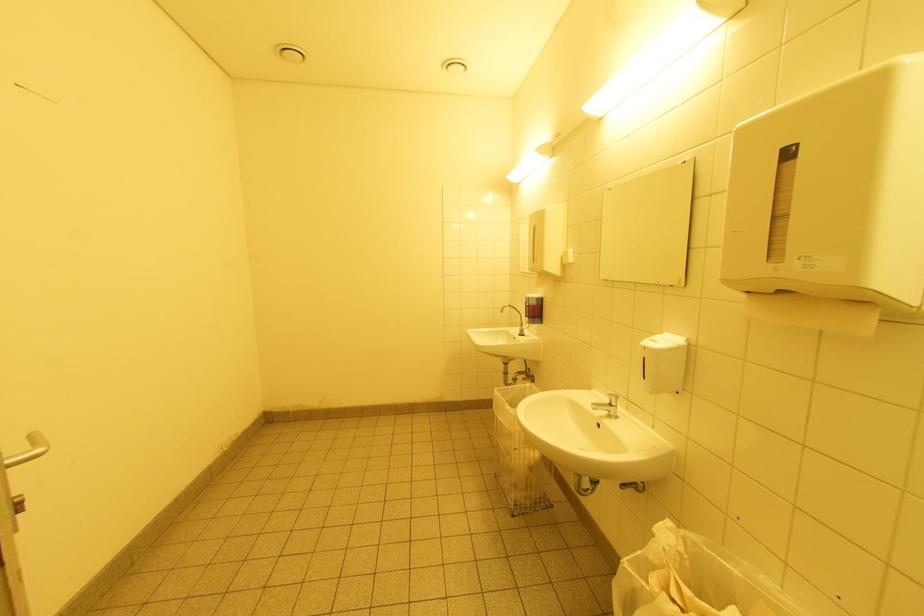
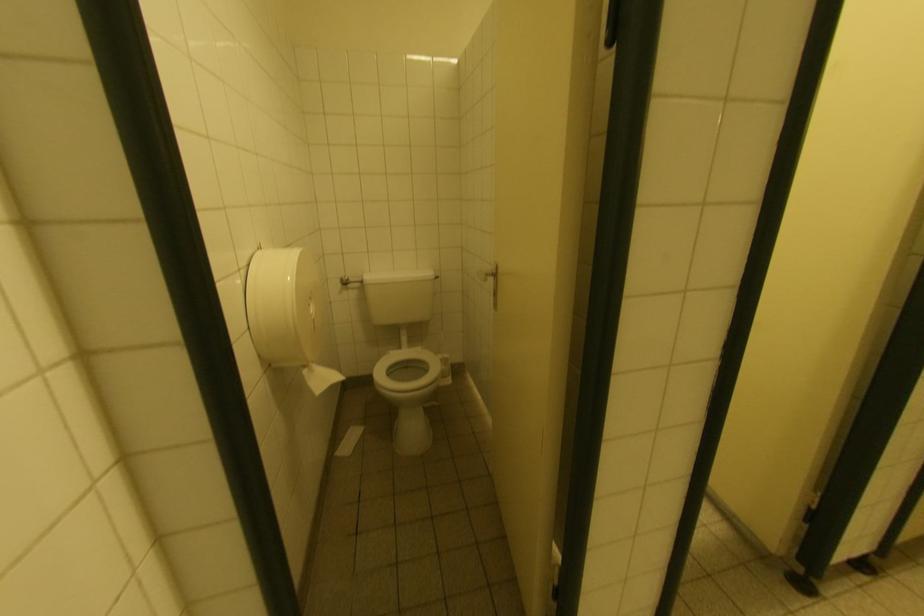
Question: What movement of the cameraman would produce the second image?

Choices:
 (A) Left
 (B) Right
 (C) Forward
 (D) Backward

Answer: (A)